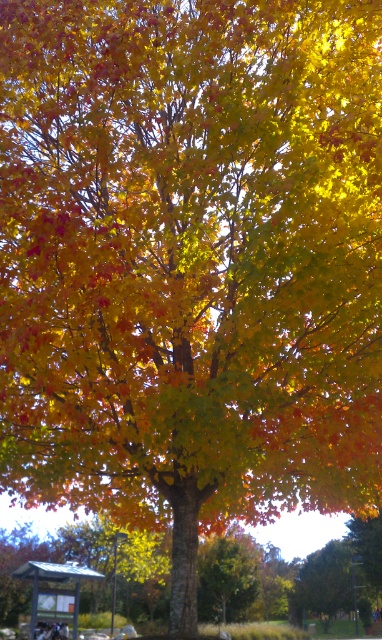
Question: From the image, what is the correct spatial relationship of shiny green leaf at center in relation to metallic silver bus stop at lower left?

Choices:
 (A) left
 (B) right

Answer: (B)

Question: Which point is closer to the camera?

Choices:
 (A) metallic silver bus stop at lower left
 (B) shiny green leaf at center

Answer: (A)

Question: Is shiny green leaf at center further to camera compared to metallic silver bus stop at lower left?

Choices:
 (A) yes
 (B) no

Answer: (A)

Question: Among these points, which one is nearest to the camera?

Choices:
 (A) (226, 532)
 (B) (76, 564)

Answer: (A)

Question: Among these points, which one is nearest to the camera?

Choices:
 (A) (33, 589)
 (B) (249, 566)

Answer: (A)

Question: Is shiny green leaf at center wider than metallic silver bus stop at lower left?

Choices:
 (A) yes
 (B) no

Answer: (B)